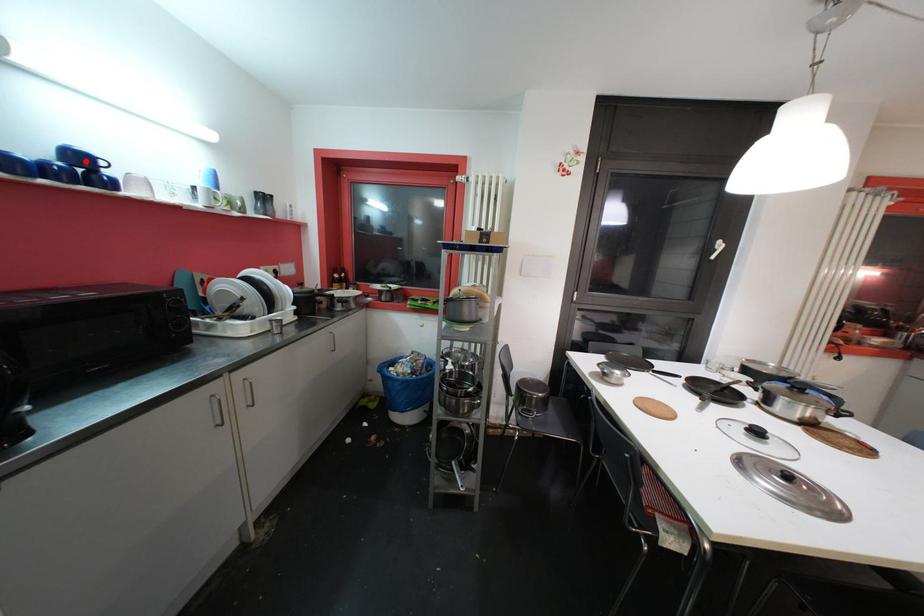
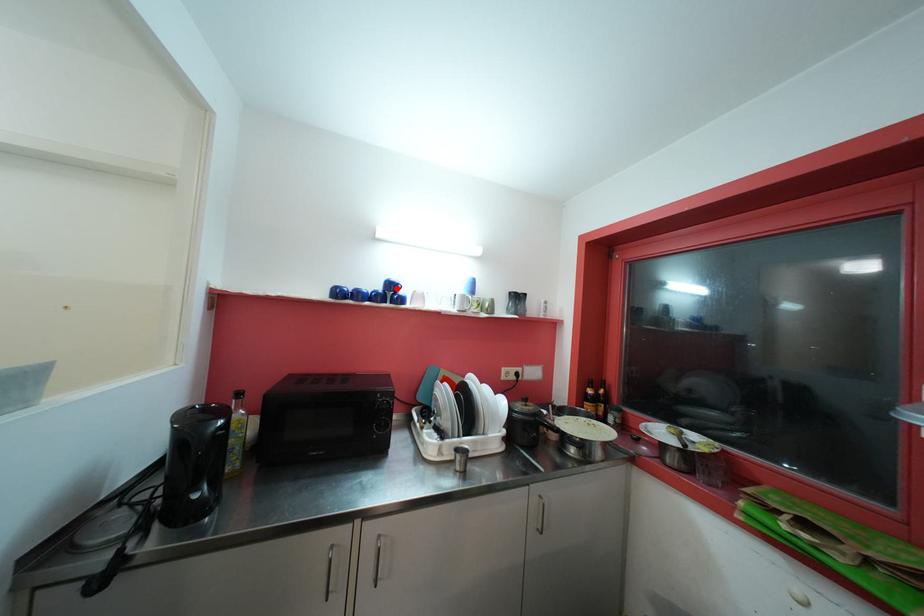
I am providing you with two images of the same scene from different viewpoints. A red point is marked on the first image and another point is marked on the second image. Does the point marked in image1 correspond to the same location as the one in image2?

Yes